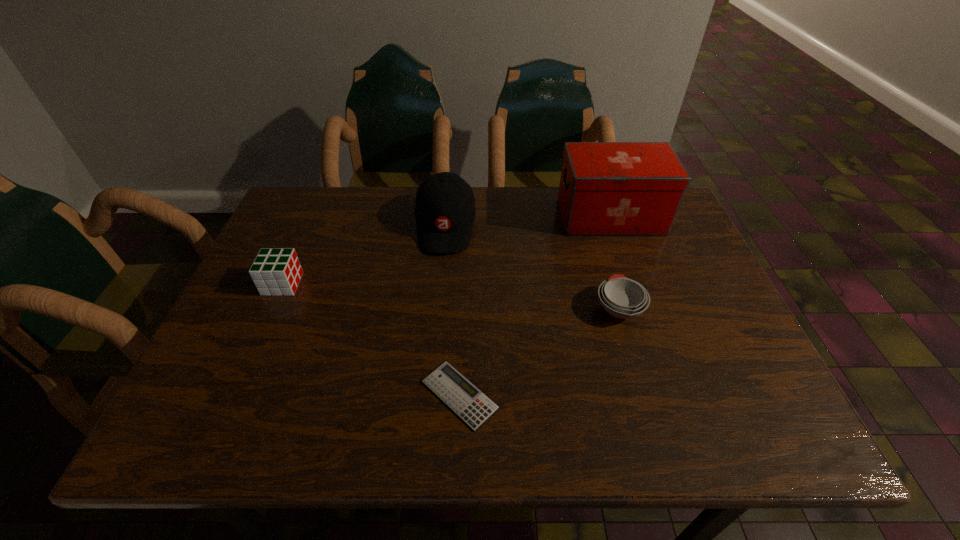
Locate an element on the screen. The image size is (960, 540). vacant area at the far edge of the desktop is located at coordinates point(414,216).

Find the location of a particular element. vacant space at the left edge of the desktop is located at coordinates (243, 358).

Locate an element on the screen. free space at the right edge of the desktop is located at coordinates (704, 289).

Where is `vacant area at the far left corner of the desktop`? vacant area at the far left corner of the desktop is located at coordinates (301, 201).

Where is `vacant space at the near right corner of the desktop`? Image resolution: width=960 pixels, height=540 pixels. vacant space at the near right corner of the desktop is located at coordinates (785, 417).

You are a GUI agent. You are given a task and a screenshot of the screen. Output one action in this format:
    pyautogui.click(x=<x>, y=<y>)
    Task: Click on the empty location between the fourth shortest object and the shortest object
    The width and height of the screenshot is (960, 540).
    Given the screenshot: What is the action you would take?
    [x=452, y=310]

Where is `free space between the shortest object and the baseball cap`? The image size is (960, 540). free space between the shortest object and the baseball cap is located at coordinates (452, 310).

Identify the location of vacant region between the baseball cap and the fourth tallest object. (532, 267).

This screenshot has height=540, width=960. What are the coordinates of `free point between the leftmost object and the second tallest object` in the screenshot? It's located at (364, 255).

The height and width of the screenshot is (540, 960). In order to click on vacant area that lies between the fourth tallest object and the baseball cap in this screenshot , I will do `click(532, 267)`.